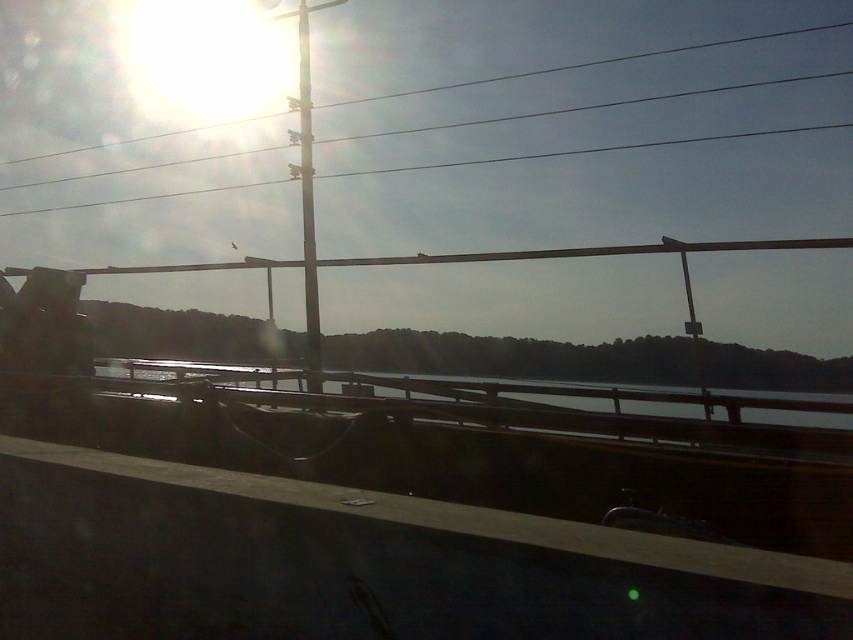
Question: Estimate the real-world distances between objects in this image. Which object is farther from the metallic pole at center?

Choices:
 (A) clear water at center
 (B) metallic wire at upper center

Answer: (A)

Question: Which point is closer to the camera taking this photo?

Choices:
 (A) (581, 401)
 (B) (709, 45)

Answer: (A)

Question: Which object appears farthest from the camera in this image?

Choices:
 (A) metallic wire at upper center
 (B) clear water at center
 (C) metallic pole at center

Answer: (A)

Question: Can you confirm if clear water at center is positioned to the right of metallic wire at upper center?

Choices:
 (A) no
 (B) yes

Answer: (B)

Question: Can you confirm if metallic wire at upper center is positioned to the left of metallic pole at center?

Choices:
 (A) no
 (B) yes

Answer: (A)

Question: Can you confirm if metallic wire at upper center is positioned below metallic pole at center?

Choices:
 (A) no
 (B) yes

Answer: (A)